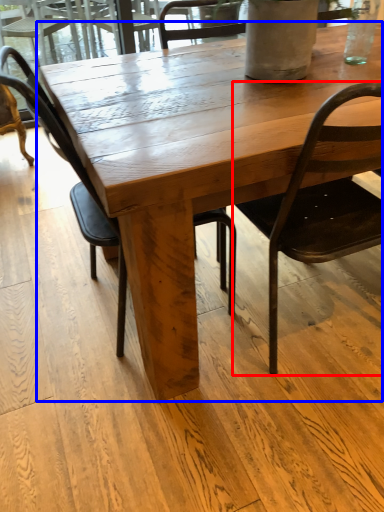
Question: Which point is closer to the camera, chair (highlighted by a red box) or coffee table (highlighted by a blue box)?

Choices:
 (A) chair
 (B) coffee table

Answer: (A)